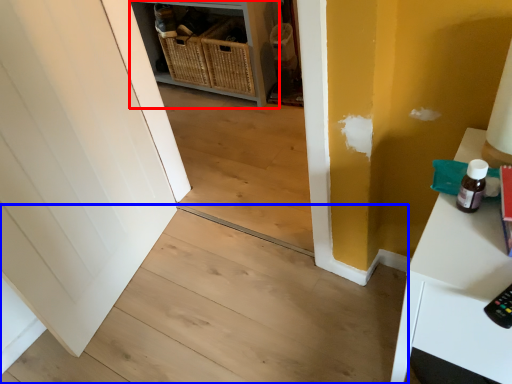
Question: Which of the following is the farthest to the observer, shelf (highlighted by a red box) or stair (highlighted by a blue box)?

Choices:
 (A) shelf
 (B) stair

Answer: (A)